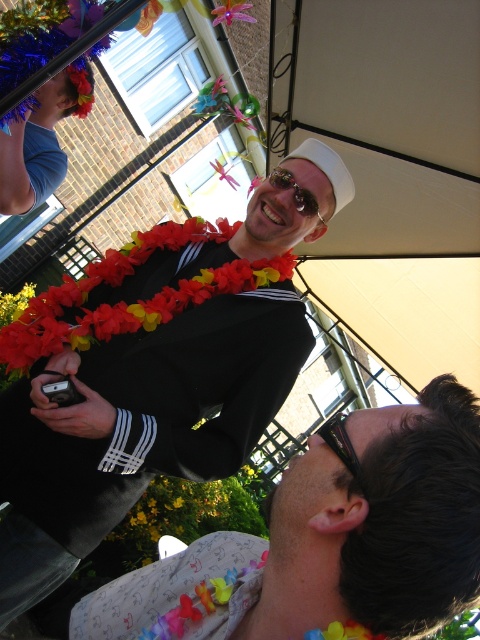
You are standing in the garden and want to walk towards the two points marked in the image. Which point, point (202, 308) or point (151, 3), will you reach first?

Point (202, 308) is closer to the viewer than point (151, 3), so you will reach point (202, 308) first.

You are standing at the entrance of the patio and want to locate the satin black sailor suit at upper center. According to the coordinates provided, where should you look?

The satin black sailor suit at upper center is located at coordinates point (136, 426).

Based on the photo, you are a photographer standing at the camera position. You need to take a closeup shot of the black plastic goggles at lower center. Can you reach it with your hand if you are 5 feet tall and your arm can extend 2.5 feet further?

The black plastic goggles at lower center is 4.60 feet away from the camera. Since your total reach is 5 feet tall plus 2.5 feet arm extension equals 7.5 feet, you can reach it.